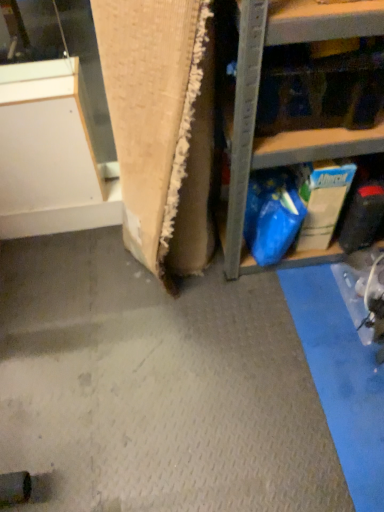
Question: Is point (296, 36) closer or farther from the camera than point (77, 201)?

Choices:
 (A) closer
 (B) farther

Answer: (A)

Question: Based on their positions, is blue plastic bag at upper right located to the left or right of white matte cabinet at upper left?

Choices:
 (A) right
 (B) left

Answer: (A)

Question: Is blue plastic bag at upper right inside the boundaries of white matte cabinet at upper left, or outside?

Choices:
 (A) outside
 (B) inside

Answer: (A)

Question: In terms of width, does white matte cabinet at upper left look wider or thinner when compared to blue plastic bag at upper right?

Choices:
 (A) wide
 (B) thin

Answer: (B)

Question: Looking at the image, does white matte cabinet at upper left seem bigger or smaller compared to blue plastic bag at upper right?

Choices:
 (A) big
 (B) small

Answer: (B)

Question: In terms of height, does white matte cabinet at upper left look taller or shorter compared to blue plastic bag at upper right?

Choices:
 (A) short
 (B) tall

Answer: (A)

Question: Is white matte cabinet at upper left spatially inside blue plastic bag at upper right, or outside of it?

Choices:
 (A) inside
 (B) outside

Answer: (B)